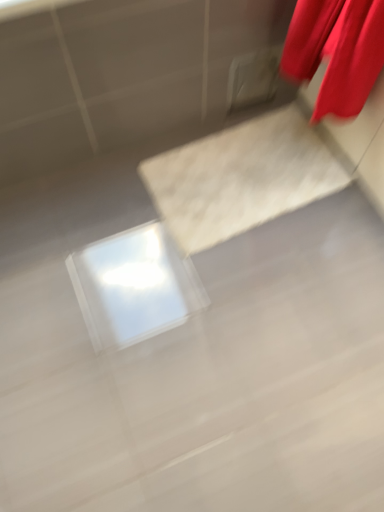
Identify the location of red satin curtain at upper right. Image resolution: width=384 pixels, height=512 pixels. (336, 51).

Describe the element at coordinates (336, 51) in the screenshot. I see `red satin curtain at upper right` at that location.

What do you see at coordinates (209, 381) in the screenshot? I see `white glossy concrete at center` at bounding box center [209, 381].

Locate an element on the screen. The image size is (384, 512). white glossy concrete at center is located at coordinates (209, 381).

Where is `red satin curtain at upper right`? The width and height of the screenshot is (384, 512). red satin curtain at upper right is located at coordinates point(336,51).

Which is more to the left, white glossy concrete at center or red satin curtain at upper right?

Positioned to the left is white glossy concrete at center.

Which is in front, white glossy concrete at center or red satin curtain at upper right?

red satin curtain at upper right is more forward.

Between point (337, 449) and point (356, 54), which one is positioned in front?

Positioned in front is point (356, 54).

From the image's perspective, between white glossy concrete at center and red satin curtain at upper right, which one is located above?

red satin curtain at upper right, from the image's perspective.

From a real-world perspective, is white glossy concrete at center under red satin curtain at upper right?

Yes, from a real-world perspective, white glossy concrete at center is under red satin curtain at upper right.

Which of these two, white glossy concrete at center or red satin curtain at upper right, is wider?

white glossy concrete at center.

Between white glossy concrete at center and red satin curtain at upper right, which one has less height?

white glossy concrete at center.

Which of these two, white glossy concrete at center or red satin curtain at upper right, is smaller?

red satin curtain at upper right is smaller.

Is white glossy concrete at center completely or partially outside of red satin curtain at upper right?

white glossy concrete at center lies outside red satin curtain at upper right's area.

Is white glossy concrete at center placed right next to red satin curtain at upper right?

No, white glossy concrete at center is not next to red satin curtain at upper right.

Looking at this image, is white glossy concrete at center facing away from red satin curtain at upper right?

No, red satin curtain at upper right is not at the back of white glossy concrete at center.

What's the angular difference between white glossy concrete at center and red satin curtain at upper right's facing directions?

The angular difference between white glossy concrete at center and red satin curtain at upper right is 90.4 degrees.

Measure the distance from white glossy concrete at center to red satin curtain at upper right.

white glossy concrete at center is 28.94 inches away from red satin curtain at upper right.

Where is `curtain to the right of white glossy concrete at center`? This screenshot has width=384, height=512. curtain to the right of white glossy concrete at center is located at coordinates (336, 51).

Considering the relative positions of red satin curtain at upper right and white glossy concrete at center in the image provided, is red satin curtain at upper right to the left of white glossy concrete at center from the viewer's perspective?

No, red satin curtain at upper right is not to the left of white glossy concrete at center.

Which object is further away from the camera, red satin curtain at upper right or white glossy concrete at center?

Positioned behind is white glossy concrete at center.

Is point (303, 34) behind point (10, 502)?

Yes, it is.

From the image's perspective, which one is positioned lower, red satin curtain at upper right or white glossy concrete at center?

From the image's view, white glossy concrete at center is below.

From a real-world perspective, is red satin curtain at upper right physically below white glossy concrete at center?

Actually, red satin curtain at upper right is physically above white glossy concrete at center in the real world.

Which object is thinner, red satin curtain at upper right or white glossy concrete at center?

red satin curtain at upper right is thinner.

Is red satin curtain at upper right taller than white glossy concrete at center?

Correct, red satin curtain at upper right is much taller as white glossy concrete at center.

Is red satin curtain at upper right smaller than white glossy concrete at center?

Yes, red satin curtain at upper right is smaller than white glossy concrete at center.

Is red satin curtain at upper right outside of white glossy concrete at center?

red satin curtain at upper right is positioned outside white glossy concrete at center.

Are red satin curtain at upper right and white glossy concrete at center located far from each other?

No, red satin curtain at upper right is not far from white glossy concrete at center.

Is red satin curtain at upper right oriented away from white glossy concrete at center?

No, red satin curtain at upper right is not facing away from white glossy concrete at center.

How many degrees apart are the facing directions of red satin curtain at upper right and white glossy concrete at center?

90.4 degrees.

In order to click on curtain above the white glossy concrete at center (from a real-world perspective) in this screenshot , I will do `click(336, 51)`.

Locate an element on the screen. concrete on the left of red satin curtain at upper right is located at coordinates (209, 381).

Locate an element on the screen. The height and width of the screenshot is (512, 384). curtain in front of the white glossy concrete at center is located at coordinates (336, 51).